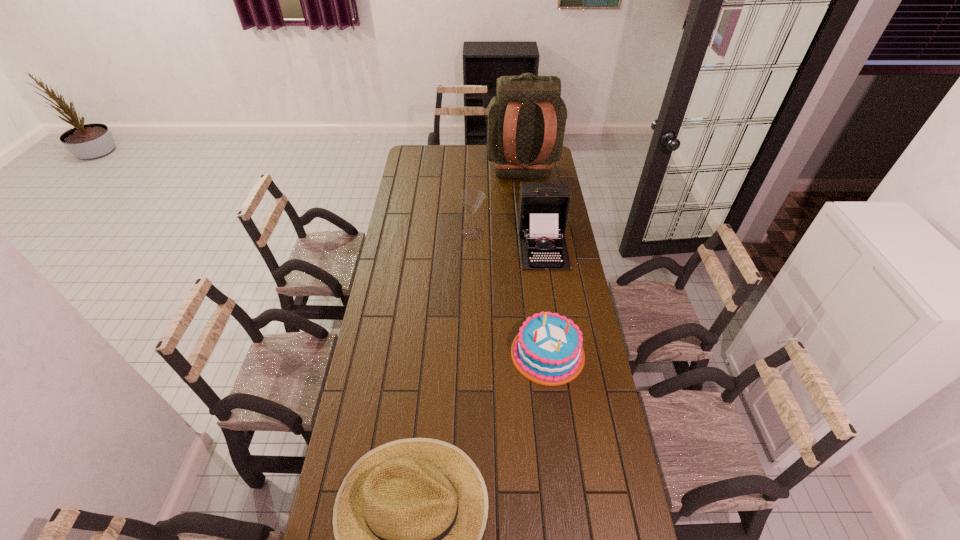
At what (x,y) coordinates should I click in order to perform the action: click on vacant area that lies between the birthday cake and the typewriter. Please return your answer as a coordinate pair (x, y). The image size is (960, 540). Looking at the image, I should click on (545, 299).

Identify which object is the third closest to the birthday cake. Please provide its 2D coordinates. Your answer should be formatted as a tuple, i.e. [(x, y)], where the tuple contains the x and y coordinates of a point satisfying the conditions above.

[(471, 198)]

Locate which object ranks third in proximity to the typewriter. Please provide its 2D coordinates. Your answer should be formatted as a tuple, i.e. [(x, y)], where the tuple contains the x and y coordinates of a point satisfying the conditions above.

[(548, 349)]